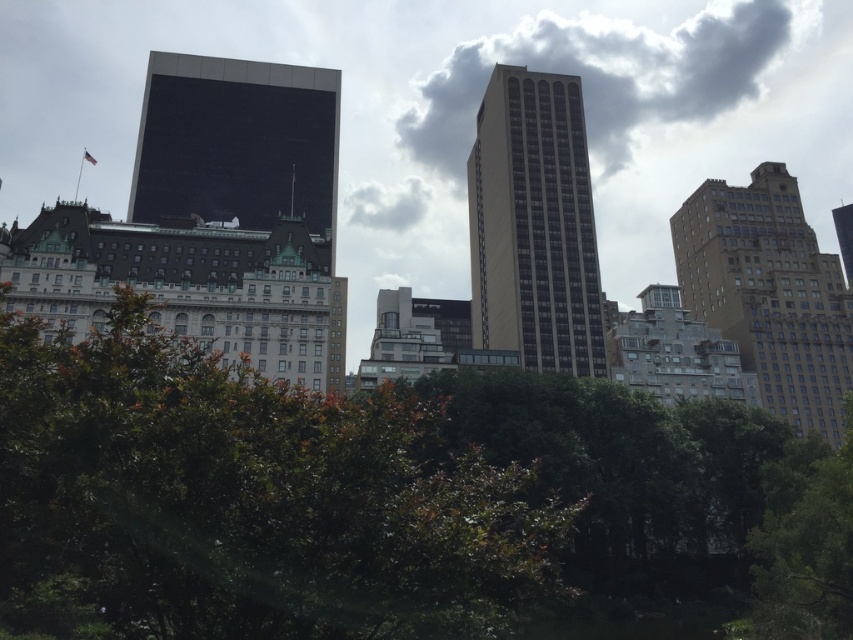
Question: Can you confirm if cloudy sky at upper center is positioned above dark glass skyscraper at center-left?

Choices:
 (A) yes
 (B) no

Answer: (A)

Question: Can you confirm if green leafy bush at lower center is thinner than dark glass skyscraper at center-left?

Choices:
 (A) yes
 (B) no

Answer: (B)

Question: Among these objects, which one is nearest to the camera?

Choices:
 (A) cloudy sky at upper center
 (B) green leafy bush at lower center
 (C) brown brick building at right

Answer: (B)

Question: Does beige smooth building at center appear under cloudy sky at upper center?

Choices:
 (A) no
 (B) yes

Answer: (B)

Question: Which of the following is the farthest from the observer?

Choices:
 (A) (805, 300)
 (B) (514, 273)

Answer: (A)

Question: Which point appears farthest from the camera in this image?

Choices:
 (A) (766, 166)
 (B) (699, 56)

Answer: (B)